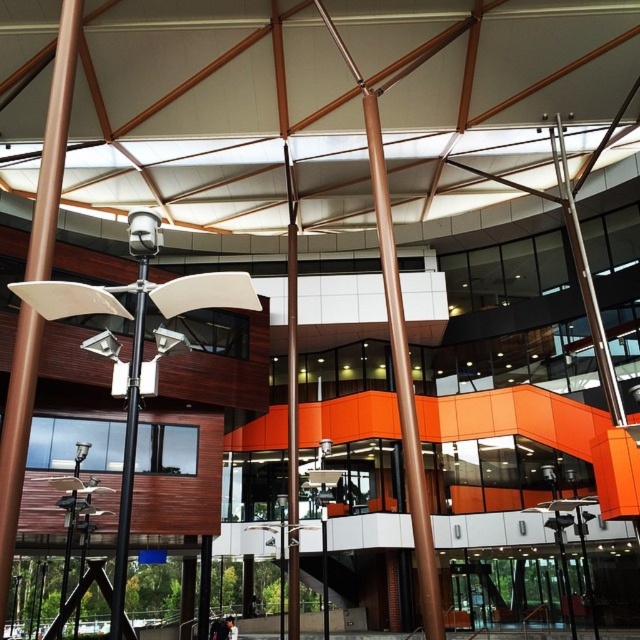
Does brown polished pole at center come in front of black metal pole at center?

No, brown polished pole at center is behind black metal pole at center.

Which of these two, brown polished pole at center or black metal pole at center, stands shorter?

black metal pole at center

Does point (58, 35) come closer to viewer compared to point (144, 326)?

That is False.

Where is `brown polished pole at center`? This screenshot has height=640, width=640. brown polished pole at center is located at coordinates (17, 438).

Between black metal pole at center and polished silver pole at upper right, which one is positioned lower?

polished silver pole at upper right is below.

Is black metal pole at center wider than polished silver pole at upper right?

No.

Between point (136, 280) and point (570, 198), which one is positioned in front?

Point (136, 280)

The image size is (640, 640). I want to click on black metal pole at center, so click(x=129, y=451).

Can you confirm if brown polished pole at center is taller than polished silver pole at upper right?

Indeed, brown polished pole at center has a greater height compared to polished silver pole at upper right.

Does brown polished pole at center appear under polished silver pole at upper right?

Incorrect, brown polished pole at center is not positioned below polished silver pole at upper right.

Does point (51, 90) come farther from viewer compared to point (566, 180)?

No, (51, 90) is closer to viewer.

The image size is (640, 640). I want to click on brown polished pole at center, so click(x=17, y=438).